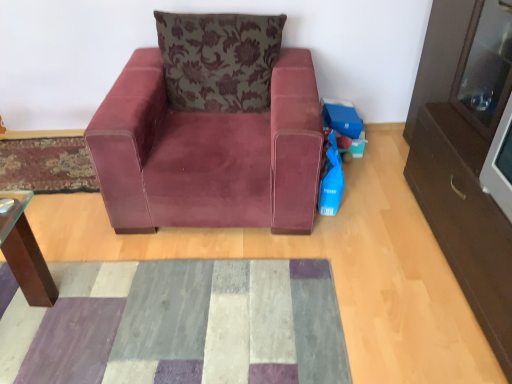
Question: Is velvet floral pillow at upper center at the right side of blue plastic toy at lower right?

Choices:
 (A) no
 (B) yes

Answer: (A)

Question: Does velvet floral pillow at upper center contain blue plastic toy at lower right?

Choices:
 (A) yes
 (B) no

Answer: (B)

Question: Does velvet floral pillow at upper center have a smaller size compared to blue plastic toy at lower right?

Choices:
 (A) yes
 (B) no

Answer: (B)

Question: Considering the relative sizes of velvet floral pillow at upper center and blue plastic toy at lower right in the image provided, is velvet floral pillow at upper center wider than blue plastic toy at lower right?

Choices:
 (A) no
 (B) yes

Answer: (B)

Question: Is velvet floral pillow at upper center outside blue plastic toy at lower right?

Choices:
 (A) yes
 (B) no

Answer: (A)

Question: Can you confirm if velvet floral pillow at upper center is thinner than blue plastic toy at lower right?

Choices:
 (A) no
 (B) yes

Answer: (A)

Question: Is patchwork fabric mat at center, the first mat in the right-to-left sequence, not near blue plastic toy at lower right?

Choices:
 (A) no
 (B) yes

Answer: (B)

Question: Does patchwork fabric mat at center, which ranks as the second mat in left-to-right order, turn towards blue plastic toy at lower right?

Choices:
 (A) yes
 (B) no

Answer: (B)

Question: Is patchwork fabric mat at center, placed as the 2th mat when sorted from top to bottom, facing away from blue plastic toy at lower right?

Choices:
 (A) no
 (B) yes

Answer: (A)

Question: Is patchwork fabric mat at center, which ranks as the second mat in left-to-right order, positioned in front of blue plastic toy at lower right?

Choices:
 (A) no
 (B) yes

Answer: (B)

Question: Is patchwork fabric mat at center, placed as the 2th mat when sorted from top to bottom, located outside blue plastic toy at lower right?

Choices:
 (A) yes
 (B) no

Answer: (A)

Question: From the image's perspective, does patchwork fabric mat at center, the first mat in the right-to-left sequence, appear lower than blue plastic toy at lower right?

Choices:
 (A) yes
 (B) no

Answer: (A)

Question: Does blue plastic toy at lower right have a lesser height compared to patchwork fabric mat at center, which ranks as the second mat in left-to-right order?

Choices:
 (A) no
 (B) yes

Answer: (A)